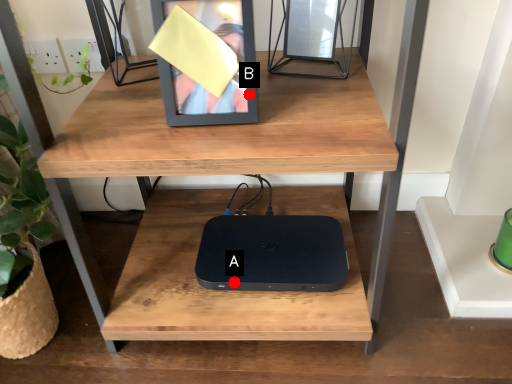
Question: Two points are circled on the image, labeled by A and B beside each circle. Which of the following is the farthest from the observer?

Choices:
 (A) A is further
 (B) B is further

Answer: (A)